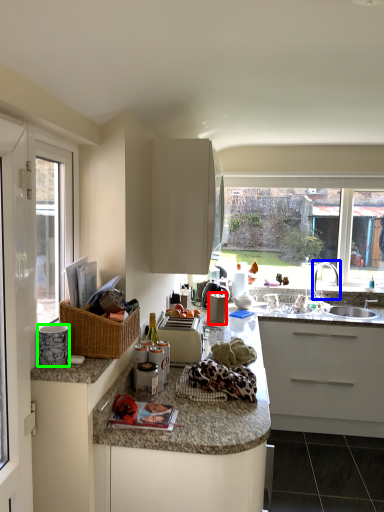
Question: Considering the real-world distances, which object is farthest from appliance (highlighted by a red box)? tap (highlighted by a blue box) or appliance (highlighted by a green box)?

Choices:
 (A) tap
 (B) appliance

Answer: (B)